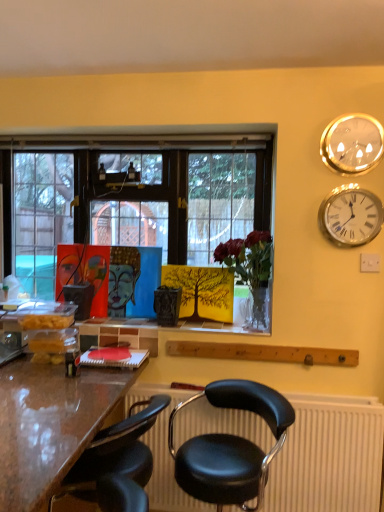
Question: In terms of width, does silver metallic clock at upper right, which is the 1th wall clock from bottom to top, look wider or thinner when compared to translucent glass vase at center?

Choices:
 (A) thin
 (B) wide

Answer: (A)

Question: Is point (344, 225) positioned closer to the camera than point (238, 267)?

Choices:
 (A) farther
 (B) closer

Answer: (B)

Question: Which object is the closest to the blue glossy painting at center?

Choices:
 (A) gold reflective glass wall clock at upper right, positioned as the second wall clock in bottom-to-top order
 (B) translucent glass vase at center
 (C) silver metallic clock at upper right, acting as the second wall clock starting from the top
 (D) shiny brown desk at lower left
 (E) black plastic radiator at lower center

Answer: (B)

Question: Which object is positioned closest to the blue glossy painting at center?

Choices:
 (A) shiny brown desk at lower left
 (B) black plastic radiator at lower center
 (C) black leather chair at center, the first chair when ordered from right to left
 (D) translucent glass vase at center
 (E) black leather chair at lower center, arranged as the second chair when viewed from the right

Answer: (D)